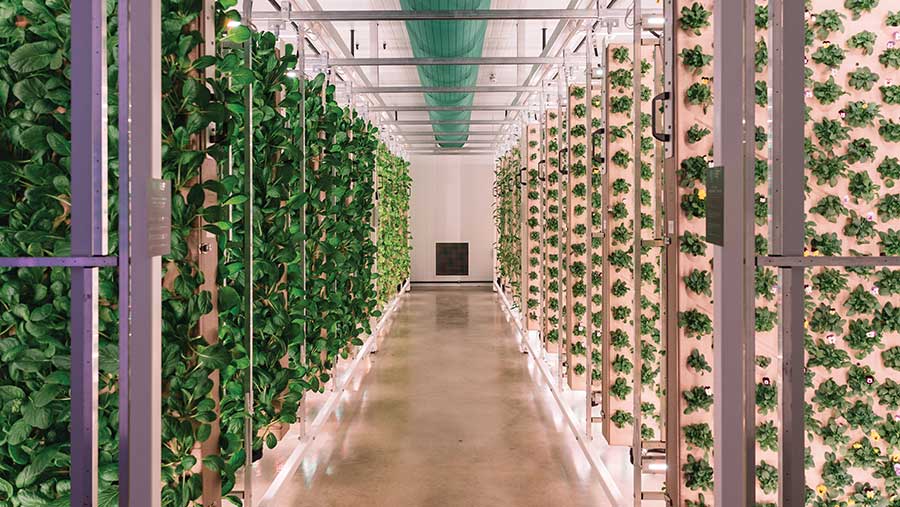
Locate an element on the screen. plant racks is located at coordinates (601, 200), (282, 239).